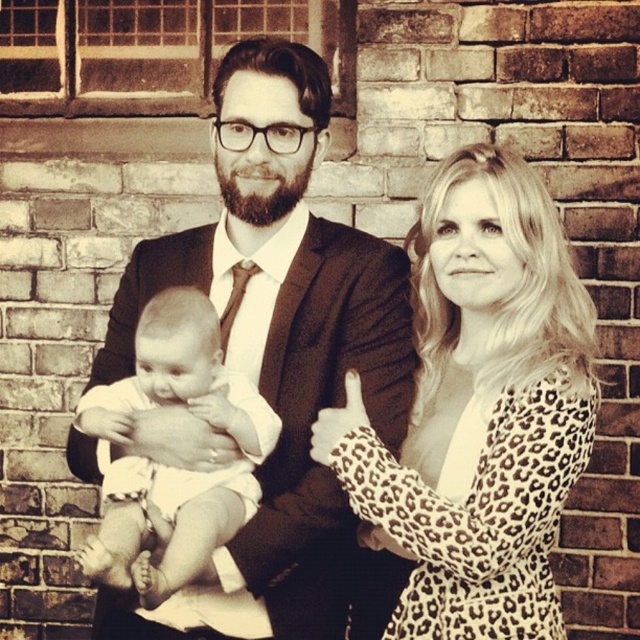
Locate an element on the screen. This screenshot has width=640, height=640. leopard print dress at center is located at coordinates (481, 410).

How distant is leopard print dress at center from white clothed baby at center?

14.06 inches

This screenshot has width=640, height=640. Identify the location of leopard print dress at center. (481, 410).

The width and height of the screenshot is (640, 640). In order to click on leopard print dress at center in this screenshot , I will do `click(481, 410)`.

Which is more to the right, black suit at center or leopard print dress at center?

Positioned to the right is leopard print dress at center.

Does point (253, 45) come closer to viewer compared to point (497, 248)?

No, (253, 45) is further to viewer.

This screenshot has width=640, height=640. I want to click on black suit at center, so click(285, 337).

Can you confirm if black suit at center is shorter than white clothed baby at center?

No, black suit at center is not shorter than white clothed baby at center.

How much distance is there between black suit at center and white clothed baby at center?

12.83 centimeters

Who is more distant from viewer, [268,536] or [161,330]?

Point [161,330]

Image resolution: width=640 pixels, height=640 pixels. I want to click on black suit at center, so click(x=285, y=337).